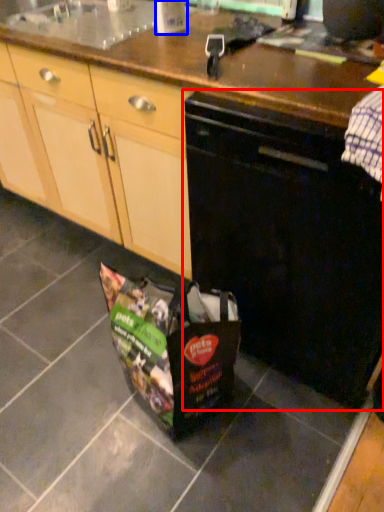
Question: Which point is closer to the camera, home appliance (highlighted by a red box) or kitchen appliance (highlighted by a blue box)?

Choices:
 (A) home appliance
 (B) kitchen appliance

Answer: (A)